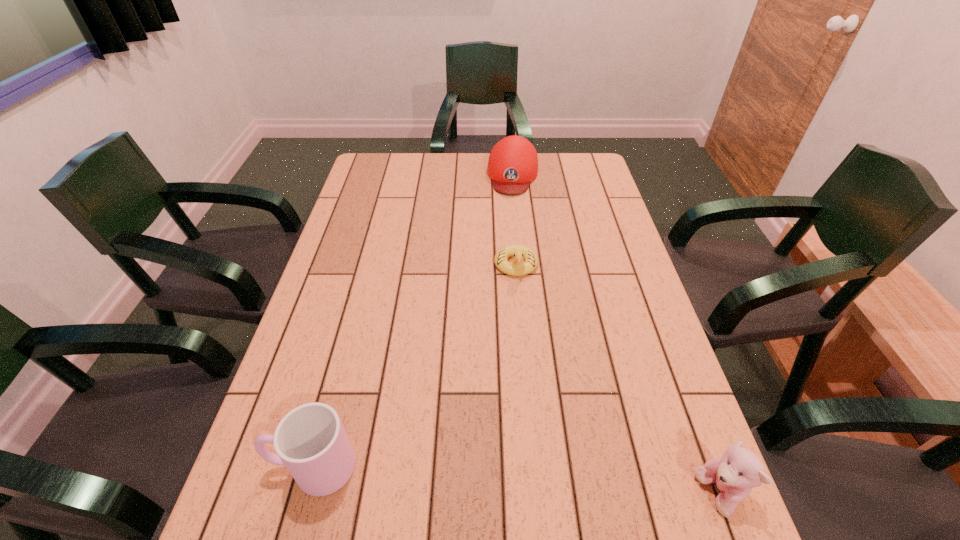
You are a GUI agent. You are given a task and a screenshot of the screen. Output one action in this format:
    pyautogui.click(x=<x>, y=<y>)
    Task: Click on the vacant space located on the front-facing side of the farthest object
    The height and width of the screenshot is (540, 960).
    Given the screenshot: What is the action you would take?
    pyautogui.click(x=509, y=228)

At what (x,y) coordinates should I click in order to perform the action: click on blank area located 0.220m on the face of the second farthest object. Please return your answer as a coordinate pair (x, y). Looking at the image, I should click on (518, 345).

What are the coordinates of `vacant space positioned on the face of the second farthest object` in the screenshot? It's located at (518, 342).

Identify the location of free point located on the face of the second farthest object. (518, 326).

What are the coordinates of `object present at the far edge` in the screenshot? It's located at (513, 162).

Identify the location of cup that is at the near edge. The width and height of the screenshot is (960, 540). (310, 440).

Where is `teddy bear that is at the near edge`? This screenshot has width=960, height=540. teddy bear that is at the near edge is located at coordinates (739, 470).

The height and width of the screenshot is (540, 960). I want to click on object at the left edge, so click(310, 440).

Where is `object at the right edge`? object at the right edge is located at coordinates (739, 470).

This screenshot has width=960, height=540. Identify the location of object at the near left corner. (310, 440).